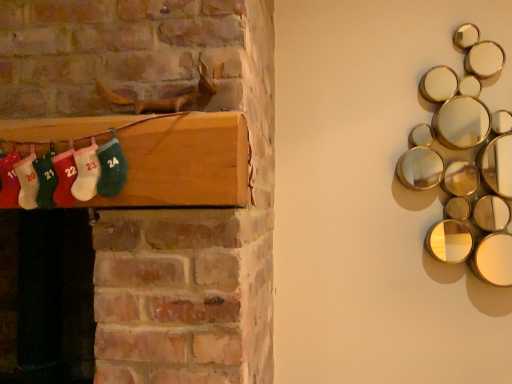
What do you see at coordinates (466, 162) in the screenshot? I see `gold reflective mirrors at upper right` at bounding box center [466, 162].

You are a GUI agent. You are given a task and a screenshot of the screen. Output one action in this format:
    pyautogui.click(x=<x>, y=<y>)
    Task: Click on the gold reflective mirrors at upper right
    The height and width of the screenshot is (384, 512).
    Given the screenshot: What is the action you would take?
    pyautogui.click(x=466, y=162)

The image size is (512, 384). I want to click on gold reflective mirrors at upper right, so click(466, 162).